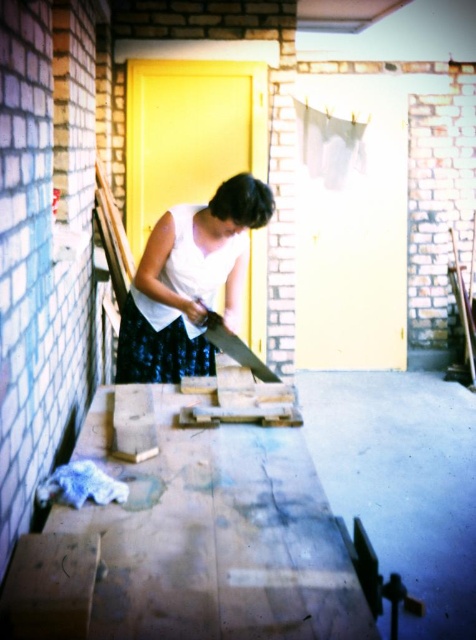
You are a photographer setting up a shoot in this backyard scene. You need to ensure that the white matte dress at center does not cast a shadow over the metallic saw at center. Given their current positions, is this possible?

The white matte dress at center is above the metallic saw at center, so its shadow would naturally fall over the metallic saw at center. To prevent this, you would need to adjust their positions or use lighting to avoid the shadow.

From the picture: You are organizing a small event and need to place a decorative mat that is 1 meter wide on the wooden table. Given the white matte dress at center and the metallic saw at center, which object might block the placement of the mat due to its size?

The white matte dress at center has a larger width than the metallic saw at center, so it is more likely to block the placement of the 1 meter wide decorative mat on the wooden table.